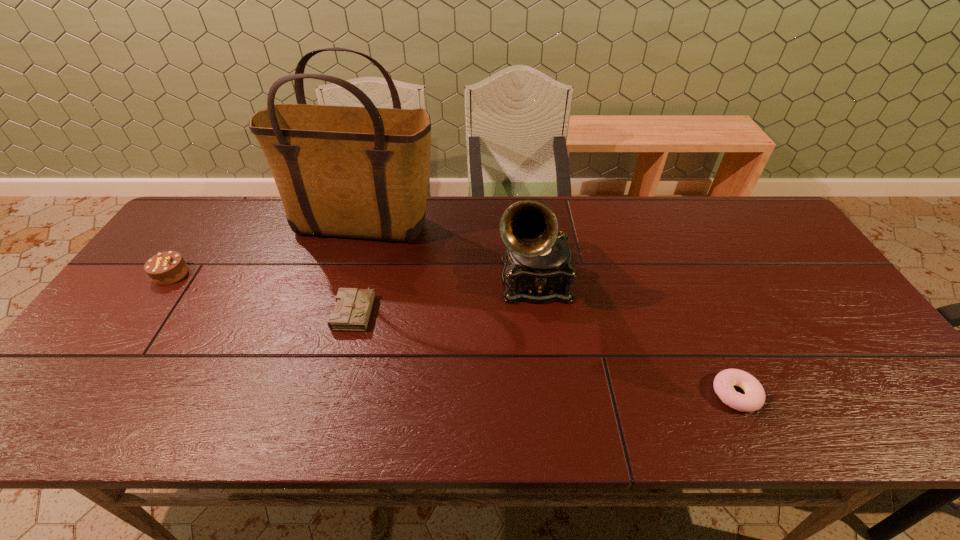
Locate an element on the screen. The height and width of the screenshot is (540, 960). the tallest object is located at coordinates (362, 172).

The width and height of the screenshot is (960, 540). In order to click on the farthest object in this screenshot , I will do `click(362, 172)`.

Image resolution: width=960 pixels, height=540 pixels. Find the location of `phonograph record`. phonograph record is located at coordinates (537, 262).

You are a GUI agent. You are given a task and a screenshot of the screen. Output one action in this format:
    pyautogui.click(x=<x>, y=<y>)
    Task: Click on the second object from right to left
    Image resolution: width=960 pixels, height=540 pixels.
    Given the screenshot: What is the action you would take?
    pyautogui.click(x=537, y=262)

This screenshot has width=960, height=540. Find the location of `the leftmost object`. the leftmost object is located at coordinates [168, 267].

Identify the location of chocolate cake. (168, 267).

You are a GUI agent. You are given a task and a screenshot of the screen. Output one action in this format:
    pyautogui.click(x=<x>, y=<y>)
    Task: Click on the diary
    The height and width of the screenshot is (540, 960).
    Given the screenshot: What is the action you would take?
    pyautogui.click(x=353, y=306)

This screenshot has width=960, height=540. Identify the location of doughnut. point(753,399).

Find the location of `the nearest object`. the nearest object is located at coordinates (753, 399).

Image resolution: width=960 pixels, height=540 pixels. Find the location of `free point located on the right of the tote bag`. free point located on the right of the tote bag is located at coordinates (541, 227).